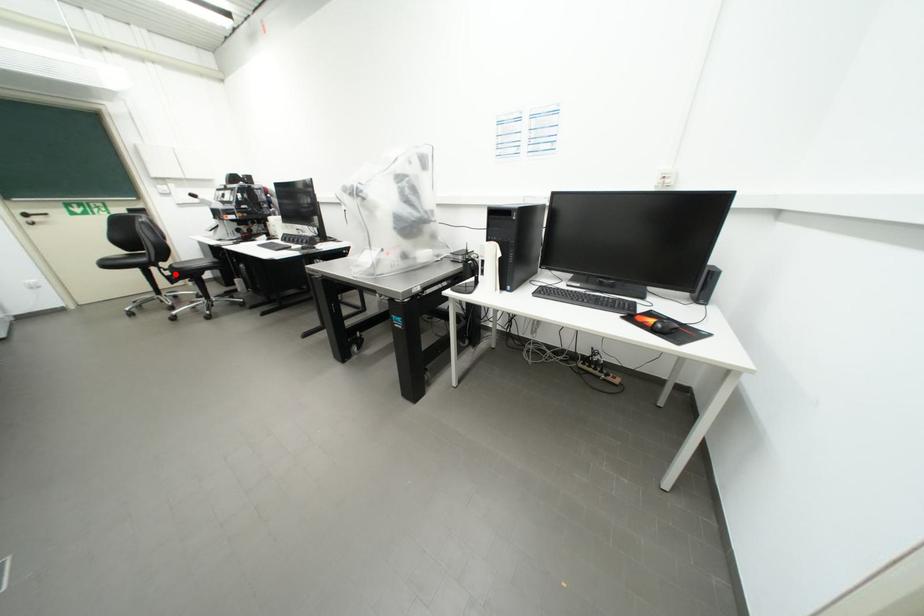
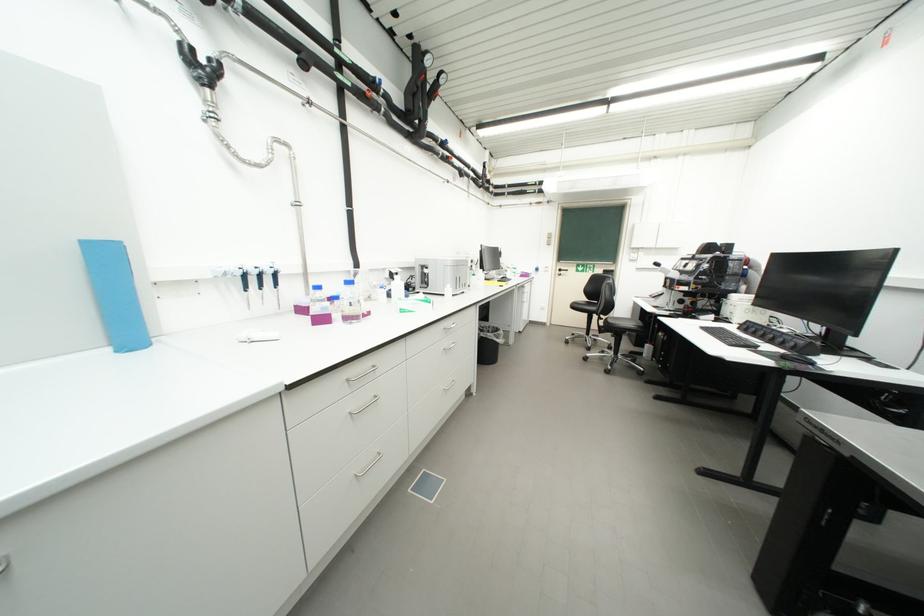
The point at the highlighted location is marked in the first image. Where is the corresponding point in the second image?

(610, 325)